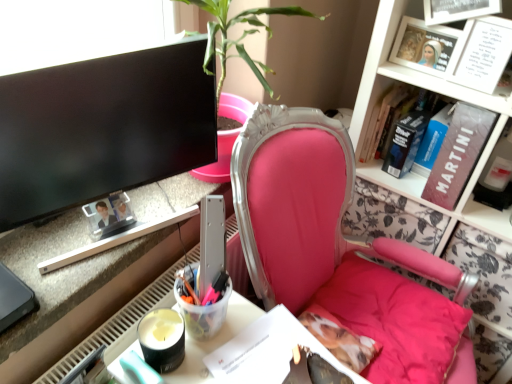
Question: Can you confirm if metallic silver desk at lower left is bigger than translucent plastic cup at lower center?

Choices:
 (A) yes
 (B) no

Answer: (A)

Question: Is metallic silver desk at lower left at the left side of translucent plastic cup at lower center?

Choices:
 (A) yes
 (B) no

Answer: (A)

Question: Considering the relative sizes of metallic silver desk at lower left and translucent plastic cup at lower center in the image provided, is metallic silver desk at lower left shorter than translucent plastic cup at lower center?

Choices:
 (A) yes
 (B) no

Answer: (A)

Question: Is metallic silver desk at lower left to the right of translucent plastic cup at lower center from the viewer's perspective?

Choices:
 (A) yes
 (B) no

Answer: (B)

Question: Is metallic silver desk at lower left looking in the opposite direction of translucent plastic cup at lower center?

Choices:
 (A) yes
 (B) no

Answer: (B)

Question: From a real-world perspective, does metallic silver desk at lower left sit lower than translucent plastic cup at lower center?

Choices:
 (A) no
 (B) yes

Answer: (A)

Question: Can you confirm if translucent plastic cup at lower center is taller than metallic silver desk at lower left?

Choices:
 (A) yes
 (B) no

Answer: (A)

Question: Is translucent plastic cup at lower center next to metallic silver desk at lower left and touching it?

Choices:
 (A) no
 (B) yes

Answer: (A)

Question: Does translucent plastic cup at lower center have a lesser width compared to metallic silver desk at lower left?

Choices:
 (A) no
 (B) yes

Answer: (B)

Question: From the image's perspective, is translucent plastic cup at lower center above metallic silver desk at lower left?

Choices:
 (A) no
 (B) yes

Answer: (A)

Question: From the image's perspective, does translucent plastic cup at lower center appear lower than metallic silver desk at lower left?

Choices:
 (A) yes
 (B) no

Answer: (A)

Question: Is translucent plastic cup at lower center oriented towards metallic silver desk at lower left?

Choices:
 (A) no
 (B) yes

Answer: (A)

Question: Is hardcover book at upper right, acting as the 5th book starting from the front, taller than hardcover book at upper right, which ranks as the 4th book in front-to-back order?

Choices:
 (A) yes
 (B) no

Answer: (A)